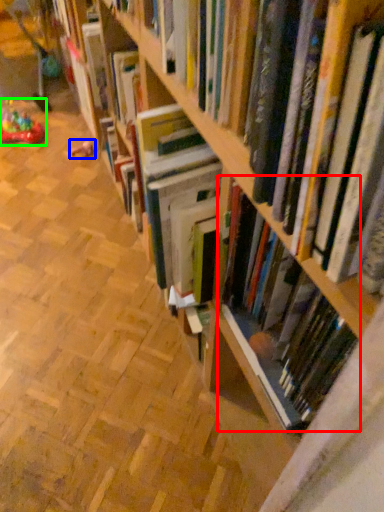
Question: Which object is the closest to the book (highlighted by a red box)? Choose among these: toy (highlighted by a blue box) or toy (highlighted by a green box).

Choices:
 (A) toy
 (B) toy

Answer: (A)